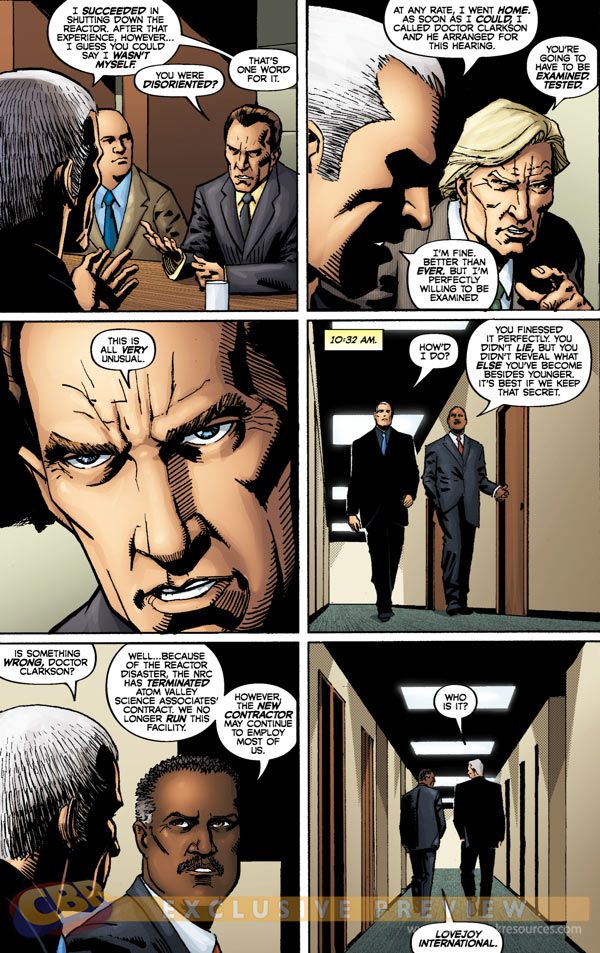
This screenshot has height=953, width=600. I want to click on hallway, so click(x=447, y=882).